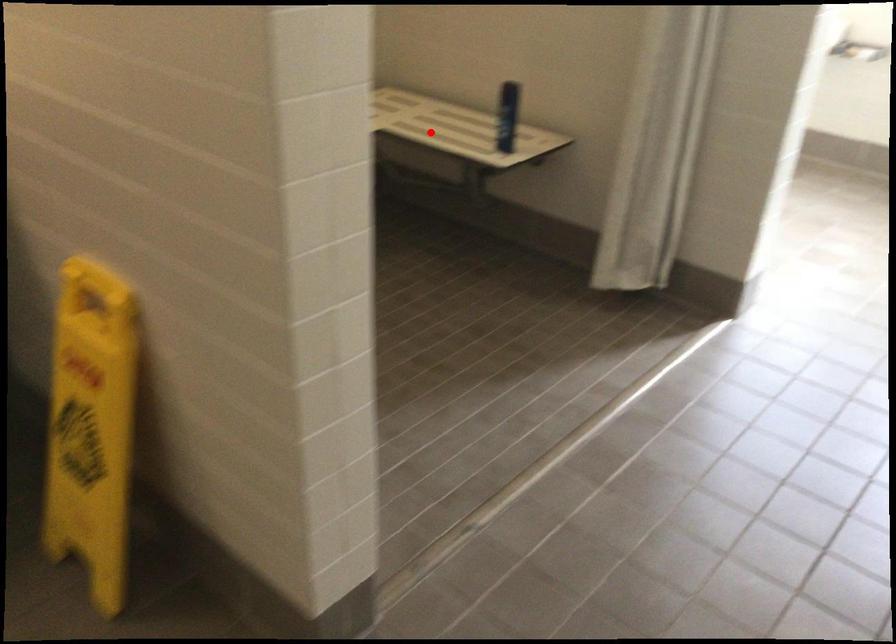
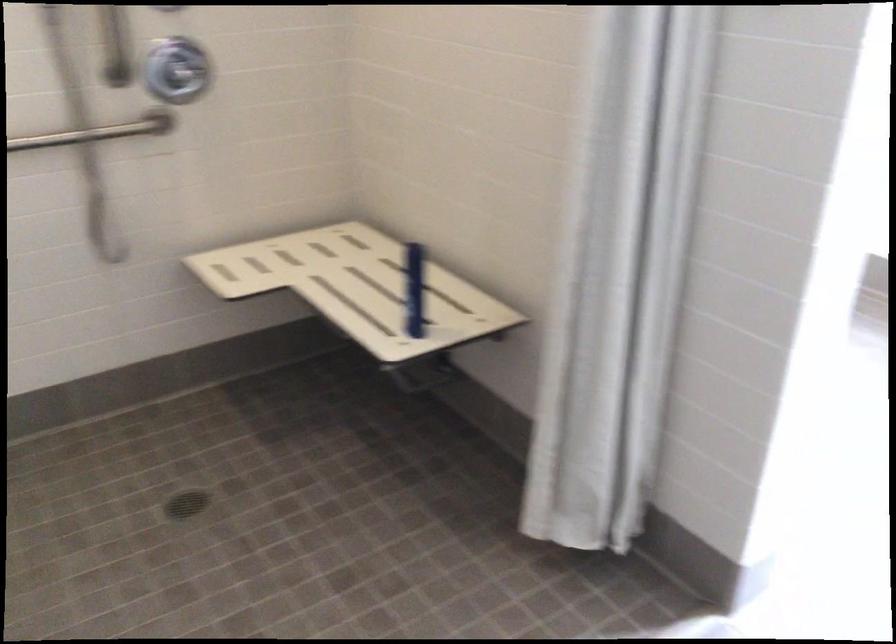
The point at the highlighted location is marked in the first image. Where is the corresponding point in the second image?

(357, 287)